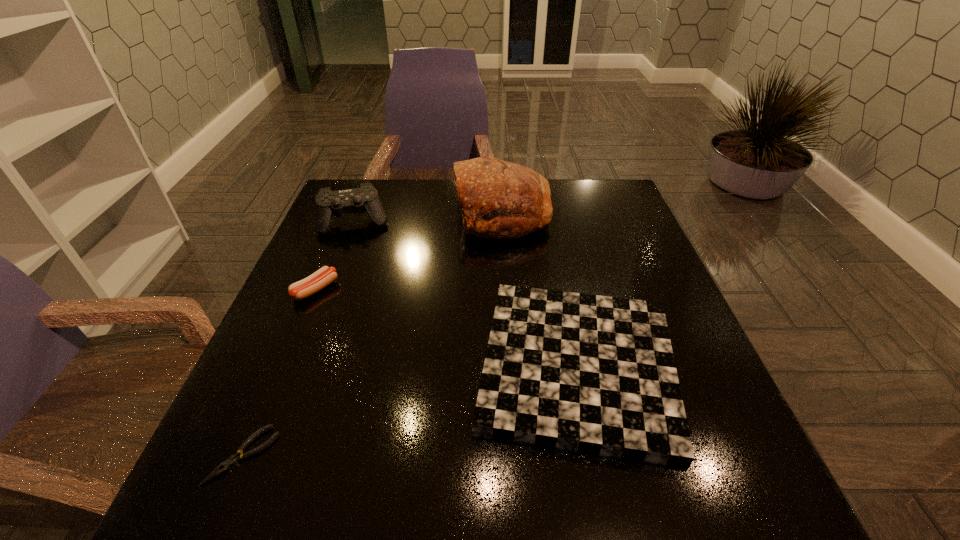
You are a GUI agent. You are given a task and a screenshot of the screen. Output one action in this format:
    pyautogui.click(x=<x>, y=<y>)
    Task: Click on the object present at the far left corner
    Image resolution: width=960 pixels, height=540 pixels.
    Given the screenshot: What is the action you would take?
    pyautogui.click(x=328, y=204)

Find the location of a particular element. object that is at the near left corner is located at coordinates (234, 459).

Where is `object that is positioned at the near right corner`? This screenshot has height=540, width=960. object that is positioned at the near right corner is located at coordinates (594, 374).

The height and width of the screenshot is (540, 960). What are the coordinates of `vacant area at the far edge of the desktop` in the screenshot? It's located at (562, 191).

Image resolution: width=960 pixels, height=540 pixels. I want to click on vacant area at the near edge, so click(501, 470).

Image resolution: width=960 pixels, height=540 pixels. In order to click on blank space at the left edge of the desktop in this screenshot , I will do tap(293, 348).

Where is `free space at the right edge`? Image resolution: width=960 pixels, height=540 pixels. free space at the right edge is located at coordinates (638, 282).

This screenshot has width=960, height=540. In order to click on free space at the far left corner of the desktop in this screenshot , I will do `click(368, 215)`.

Where is `free location at the far right corner`? Image resolution: width=960 pixels, height=540 pixels. free location at the far right corner is located at coordinates (598, 184).

Identify the location of free space at the near right corner. The image size is (960, 540). (770, 510).